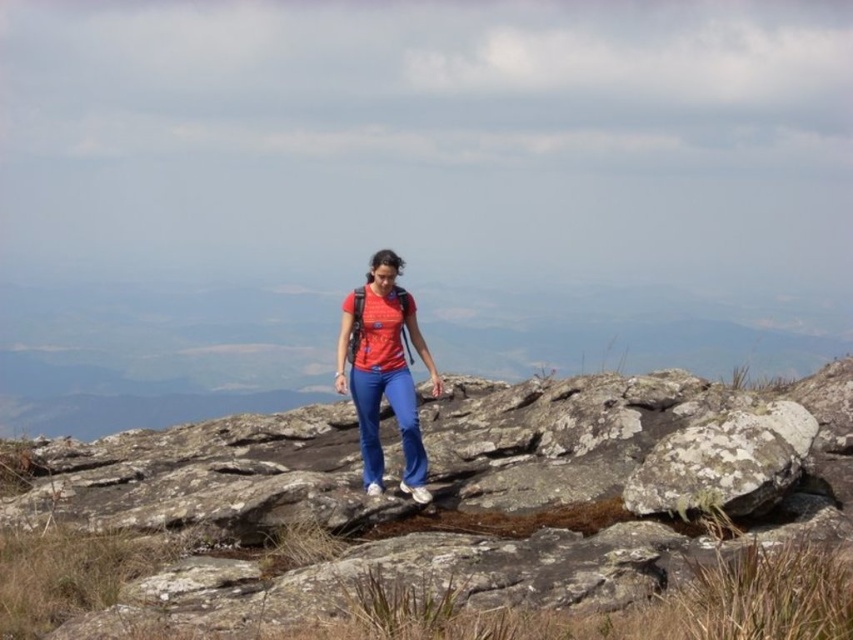
Can you confirm if lichen-covered rock at center is positioned below matte red shirt at center?

Correct, lichen-covered rock at center is located below matte red shirt at center.

Is lichen-covered rock at center smaller than matte red shirt at center?

Correct, lichen-covered rock at center occupies less space than matte red shirt at center.

Which is in front, point (207, 602) or point (363, 292)?

Point (207, 602)

The height and width of the screenshot is (640, 853). What are the coordinates of `lichen-covered rock at center` in the screenshot? It's located at tap(463, 493).

Is lichen-covered rock at center-right below matte red shirt at center?

Correct, lichen-covered rock at center-right is located below matte red shirt at center.

Locate an element on the screen. The width and height of the screenshot is (853, 640). lichen-covered rock at center-right is located at coordinates (724, 461).

Does lichen-covered rock at center come behind lichen-covered rock at center-right?

No.

Is point (138, 582) positioned after point (781, 404)?

No, (138, 582) is closer to viewer.

Which is in front, point (329, 595) or point (766, 413)?

Point (329, 595) is more forward.

Identify the location of lichen-covered rock at center. The height and width of the screenshot is (640, 853). (463, 493).